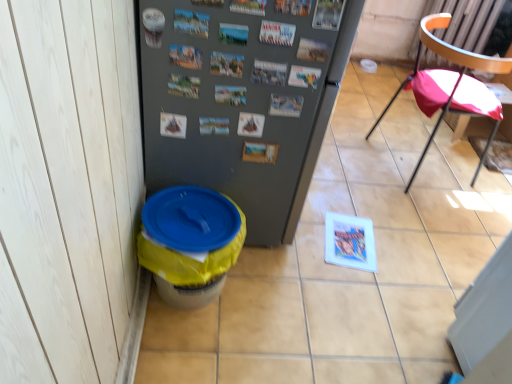
This screenshot has width=512, height=384. Identify the location of free space in front of pink fabric chair at right. (428, 218).